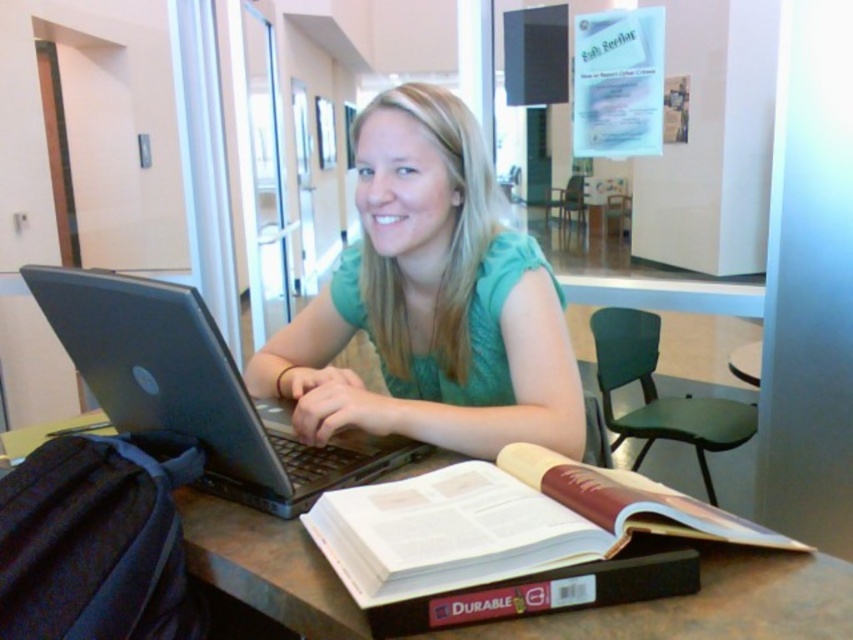
Is point (471, 456) positioned in front of point (125, 371)?

No, it is not.

Between matte black laptop at center and black matte laptop at center, which one has less height?

Standing shorter between the two is black matte laptop at center.

The image size is (853, 640). Find the location of `matte black laptop at center`. matte black laptop at center is located at coordinates (431, 300).

The width and height of the screenshot is (853, 640). I want to click on matte black laptop at center, so click(431, 300).

Does hardcover book at center have a lesser height compared to brown wooden table at center?

Yes.

Where is `hardcover book at center`? The height and width of the screenshot is (640, 853). hardcover book at center is located at coordinates (502, 524).

Which is behind, point (555, 458) or point (735, 557)?

The point (555, 458) is more distant.

Where is `hardcover book at center`? hardcover book at center is located at coordinates (502, 524).

Can you confirm if hardcover book at center is positioned above black matte laptop at center?

No.

Between point (526, 477) and point (235, 460), which one is positioned in front?

Point (526, 477) is in front.

Identify the location of hardcover book at center. (502, 524).